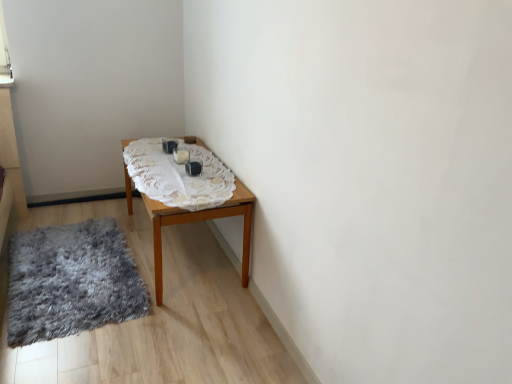
At what (x,y) coordinates should I click in order to perform the action: click on shaggy gray rug at lower left. Please return your answer as a coordinate pair (x, y). The image size is (512, 384). Looking at the image, I should click on (71, 281).

What is the approximate height of shaggy gray rug at lower left?

The height of shaggy gray rug at lower left is 2.44 inches.

Find the location of a particular element. The image size is (512, 384). wooden table at center is located at coordinates (198, 221).

Measure the distance between point (179, 200) and camera.

The distance of point (179, 200) from camera is 2.04 meters.

Image resolution: width=512 pixels, height=384 pixels. I want to click on shaggy gray rug at lower left, so click(x=71, y=281).

Is shaggy gray rug at lower left bigger than wooden table at center?

No.

Measure the distance from shaggy gray rug at lower left to wooden table at center.

shaggy gray rug at lower left and wooden table at center are 21.92 inches apart from each other.

Considering the sizes of objects shaggy gray rug at lower left and wooden table at center in the image provided, who is taller, shaggy gray rug at lower left or wooden table at center?

wooden table at center is taller.

Between shaggy gray rug at lower left and wooden table at center, which one is positioned behind?

wooden table at center.

Is point (209, 174) closer or farther from the camera than point (245, 257)?

Point (209, 174) is farther from the camera than point (245, 257).

In terms of width, does white lace tablecloth at center look wider or thinner when compared to wooden table at center?

Considering their sizes, white lace tablecloth at center looks broader than wooden table at center.

In the image, is white lace tablecloth at center positioned in front of or behind wooden table at center?

In the image, white lace tablecloth at center appears in front of wooden table at center.

Is white lace tablecloth at center looking in the opposite direction of wooden table at center?

Yes, white lace tablecloth at center is positioned with its back facing wooden table at center.

Who is smaller, white lace tablecloth at center or shaggy gray rug at lower left?

With smaller size is white lace tablecloth at center.

Which is closer to the camera, [163,160] or [88,273]?

Positioned in front is point [88,273].

Is white lace tablecloth at center positioned with its back to shaggy gray rug at lower left?

No, white lace tablecloth at center is not facing away from shaggy gray rug at lower left.

Is shaggy gray rug at lower left inside white lace tablecloth at center?

Definitely not — shaggy gray rug at lower left is not inside white lace tablecloth at center.

Is wooden table at center thinner than shaggy gray rug at lower left?

Yes, wooden table at center is thinner than shaggy gray rug at lower left.

Is the surface of wooden table at center in direct contact with shaggy gray rug at lower left?

wooden table at center is not next to shaggy gray rug at lower left, and they're not touching.

Which is correct: wooden table at center is inside shaggy gray rug at lower left, or outside of it?

wooden table at center exists outside the volume of shaggy gray rug at lower left.

Is wooden table at center taller than shaggy gray rug at lower left?

Yes, wooden table at center is taller than shaggy gray rug at lower left.

Is shaggy gray rug at lower left next to white lace tablecloth at center and touching it?

shaggy gray rug at lower left and white lace tablecloth at center are not in contact.

Would you say white lace tablecloth at center is part of shaggy gray rug at lower left's contents?

No, white lace tablecloth at center is located outside of shaggy gray rug at lower left.

Consider the image. Considering the relative sizes of shaggy gray rug at lower left and white lace tablecloth at center in the image provided, is shaggy gray rug at lower left taller than white lace tablecloth at center?

Correct, shaggy gray rug at lower left is much taller as white lace tablecloth at center.

Which of these two, shaggy gray rug at lower left or white lace tablecloth at center, is bigger?

With larger size is shaggy gray rug at lower left.

Is wooden table at center located outside white lace tablecloth at center?

wooden table at center lies outside white lace tablecloth at center's area.

Considering the sizes of objects wooden table at center and white lace tablecloth at center in the image provided, who is thinner, wooden table at center or white lace tablecloth at center?

wooden table at center.

From the image's perspective, which is above, wooden table at center or white lace tablecloth at center?

white lace tablecloth at center appears higher in the image.

Where is `table above the shaggy gray rug at lower left (from a real-world perspective)`? Image resolution: width=512 pixels, height=384 pixels. table above the shaggy gray rug at lower left (from a real-world perspective) is located at coordinates (198, 221).

Locate an element on the screen. This screenshot has width=512, height=384. table below the white lace tablecloth at center (from the image's perspective) is located at coordinates (198, 221).

From the image, which object appears to be nearer to wooden table at center, shaggy gray rug at lower left or white lace tablecloth at center?

Based on the image, white lace tablecloth at center appears to be nearer to wooden table at center.

When comparing their distances from white lace tablecloth at center, does wooden table at center or shaggy gray rug at lower left seem closer?

wooden table at center is closer to white lace tablecloth at center.

Estimate the real-world distances between objects in this image. Which object is closer to wooden table at center, white lace tablecloth at center or shaggy gray rug at lower left?

white lace tablecloth at center lies closer to wooden table at center than the other object.

Estimate the real-world distances between objects in this image. Which object is further from white lace tablecloth at center, shaggy gray rug at lower left or wooden table at center?

Based on the image, shaggy gray rug at lower left appears to be further to white lace tablecloth at center.

Which object lies nearer to the anchor point shaggy gray rug at lower left, white lace tablecloth at center or wooden table at center?

wooden table at center is positioned closer to the anchor shaggy gray rug at lower left.

Looking at the image, which one is located closer to shaggy gray rug at lower left, wooden table at center or white lace tablecloth at center?

Among the two, wooden table at center is located nearer to shaggy gray rug at lower left.

Find the location of `table located between shaggy gray rug at lower left and white lace tablecloth at center in the left-right direction`. table located between shaggy gray rug at lower left and white lace tablecloth at center in the left-right direction is located at coordinates (198, 221).